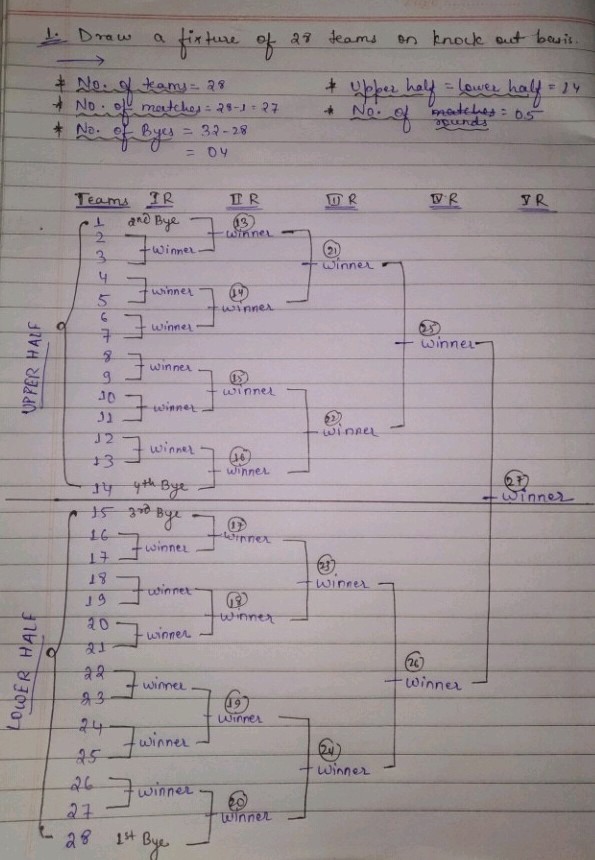
I want to click on brackets, so click(x=84, y=799), click(x=87, y=785), click(x=181, y=739), click(x=137, y=629), click(x=137, y=593), click(x=209, y=624), click(x=218, y=531), click(x=302, y=576), click(x=393, y=625).